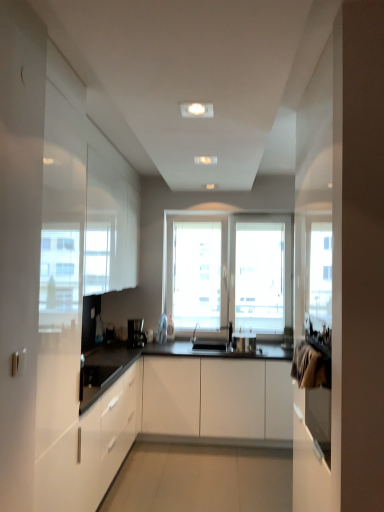
Question: From a real-world perspective, is white glossy cabinet at left, positioned as the second cabinetry in right-to-left order, physically located above or below black plastic coffee machine at center?

Choices:
 (A) below
 (B) above

Answer: (A)

Question: Is white glossy cabinet at left, which is counted as the 1th cabinetry, starting from the left, wider or thinner than black plastic coffee machine at center?

Choices:
 (A) wide
 (B) thin

Answer: (A)

Question: Estimate the real-world distances between objects in this image. Which object is farther from the white glossy cabinet at left, positioned as the second cabinetry in right-to-left order?

Choices:
 (A) black plastic coffee machine at center
 (B) metallic silver pot at center
 (C) white matte cabinet at center, acting as the 1th cabinetry starting from the right

Answer: (B)

Question: Estimate the real-world distances between objects in this image. Which object is closer to the black plastic coffee machine at center?

Choices:
 (A) white matte cabinet at center, which appears as the second cabinetry when viewed from the left
 (B) white glossy cabinet at left, positioned as the second cabinetry in right-to-left order
 (C) metallic silver pot at center

Answer: (A)